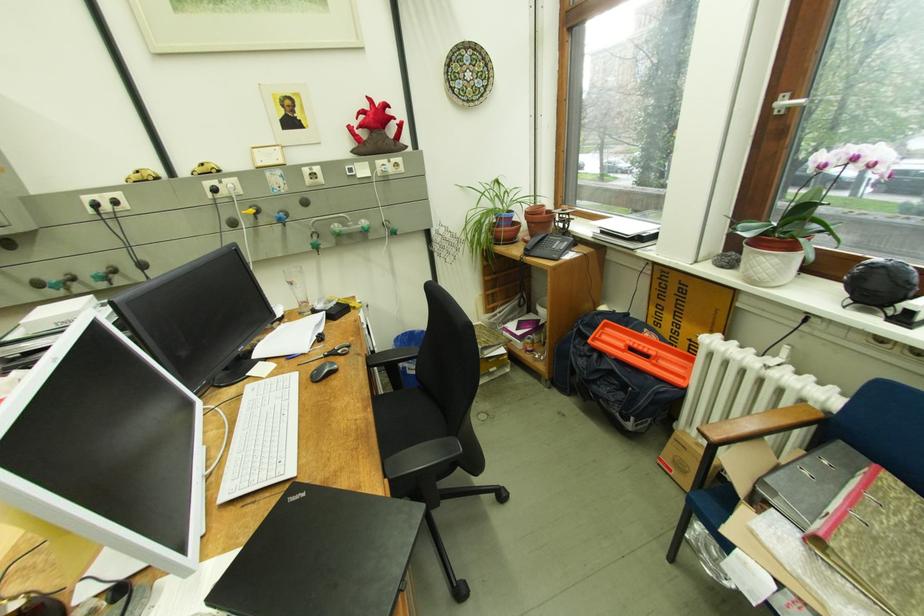
Where is `telephone handset`? telephone handset is located at coordinates (548, 246).